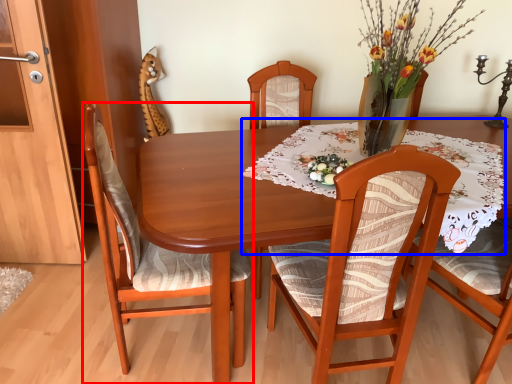
Question: Which object is further to the camera taking this photo, chair (highlighted by a red box) or tablecloth (highlighted by a blue box)?

Choices:
 (A) chair
 (B) tablecloth

Answer: (B)